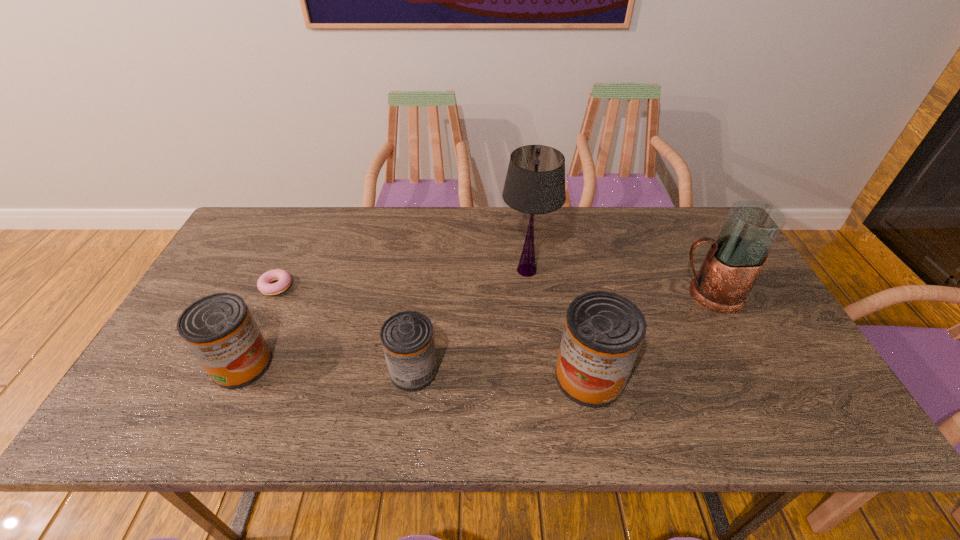
I want to click on vacant area between the rightmost object and the rightmost can, so click(649, 336).

The image size is (960, 540). Find the location of `empty space between the shortest can and the rightmost object`. empty space between the shortest can and the rightmost object is located at coordinates (561, 333).

I want to click on free area in between the tallest object and the fifth shortest object, so click(x=617, y=282).

The width and height of the screenshot is (960, 540). What are the coordinates of `blank region between the shortest can and the third shortest object` in the screenshot? It's located at (328, 368).

Where is `free space between the second tallest object and the shortest can`? This screenshot has width=960, height=540. free space between the second tallest object and the shortest can is located at coordinates tap(561, 333).

You are a GUI agent. You are given a task and a screenshot of the screen. Output one action in this format:
    pyautogui.click(x=<x>, y=<y>)
    Task: Click on the vacant area that lies between the second tallest can and the lampshade
    Image resolution: width=960 pixels, height=540 pixels.
    Given the screenshot: What is the action you would take?
    pyautogui.click(x=384, y=318)

Find the location of `free space between the second tallest object and the third object from left to right`. free space between the second tallest object and the third object from left to right is located at coordinates (561, 333).

Locate an element on the screen. This screenshot has width=960, height=540. vacant space in between the shortest object and the fourth tallest object is located at coordinates (259, 325).

Find the location of a particular element. The image size is (960, 540). the fifth closest object to the rightmost object is located at coordinates (263, 284).

Image resolution: width=960 pixels, height=540 pixels. Find the location of `object that stands as the second closest to the rightmost can`. object that stands as the second closest to the rightmost can is located at coordinates (735, 259).